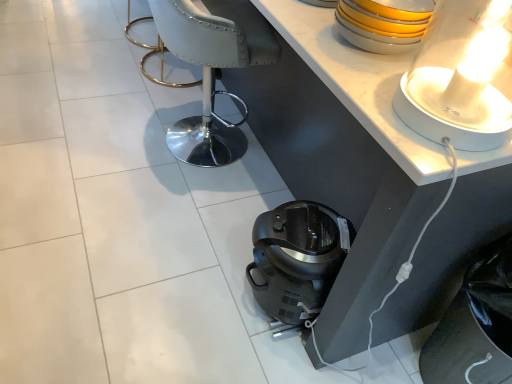
Find the location of a particular element. Image resolution: width=512 pixels, height=384 pixels. free spot above satin black coffee maker at lower center (from a real-world perspective) is located at coordinates (313, 232).